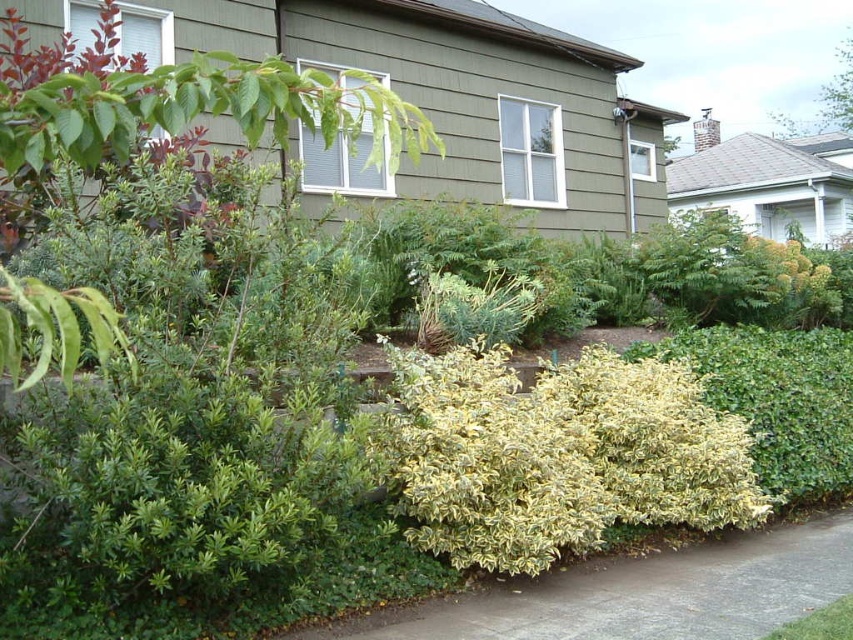
Question: Which object appears farthest from the camera in this image?

Choices:
 (A) gray concrete pavement at lower center
 (B) green leafy bush at upper center
 (C) green leafy tree at upper left

Answer: (B)

Question: Which object is positioned farthest from the gray concrete pavement at lower center?

Choices:
 (A) green leafy bush at upper center
 (B) green leafy tree at upper left

Answer: (A)

Question: Is green leafy tree at upper left to the right of green leafy bush at upper center from the viewer's perspective?

Choices:
 (A) yes
 (B) no

Answer: (B)

Question: From the image, what is the correct spatial relationship of green leafy tree at upper left in relation to gray concrete pavement at lower center?

Choices:
 (A) left
 (B) right

Answer: (A)

Question: Which of these objects is positioned closest to the green leafy tree at upper left?

Choices:
 (A) green leafy bush at upper center
 (B) gray concrete pavement at lower center

Answer: (B)

Question: In this image, where is green leafy tree at upper left located relative to green leafy bush at upper center?

Choices:
 (A) above
 (B) below

Answer: (B)